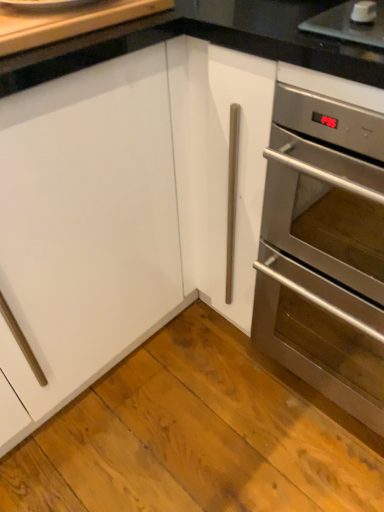
Image resolution: width=384 pixels, height=512 pixels. I want to click on wooden at upper left, so click(71, 24).

What do you see at coordinates (71, 24) in the screenshot?
I see `wooden at upper left` at bounding box center [71, 24].

What is the approximate width of wooden at upper left?

The width of wooden at upper left is 25.36 centimeters.

You are a GUI agent. You are given a task and a screenshot of the screen. Output one action in this format:
    pyautogui.click(x=<x>, y=<y>)
    Task: Click on the wooden at upper left
    This screenshot has width=384, height=512.
    Given the screenshot: What is the action you would take?
    pyautogui.click(x=71, y=24)